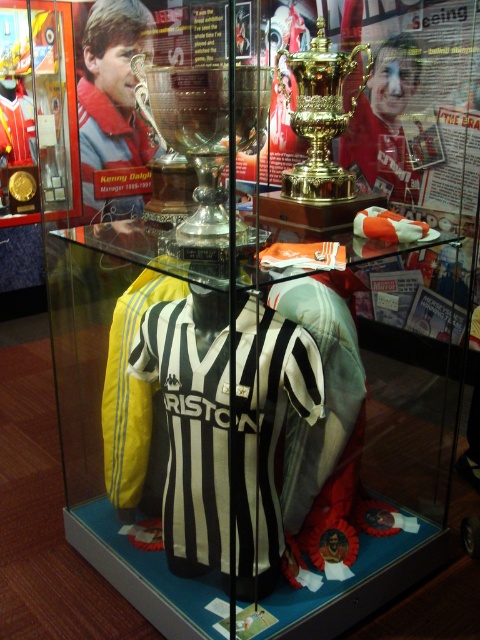
Question: Which object appears closest to the camera in this image?

Choices:
 (A) black and white striped jersey at center
 (B) gold polished trophy at upper center
 (C) silver polished trophy at center

Answer: (C)

Question: Which object is farther from the camera taking this photo?

Choices:
 (A) black and white striped jersey at center
 (B) gold polished trophy at upper center
 (C) silver polished trophy at center

Answer: (B)

Question: In this image, where is black and white striped jersey at center located relative to gold polished trophy at upper center?

Choices:
 (A) right
 (B) left

Answer: (B)

Question: Which object is positioned closest to the gold polished trophy at upper center?

Choices:
 (A) silver polished trophy at center
 (B) black and white striped jersey at center

Answer: (A)

Question: Can you confirm if black and white striped jersey at center is wider than gold polished trophy at upper center?

Choices:
 (A) no
 (B) yes

Answer: (B)

Question: Is black and white striped jersey at center above gold polished trophy at upper center?

Choices:
 (A) no
 (B) yes

Answer: (A)